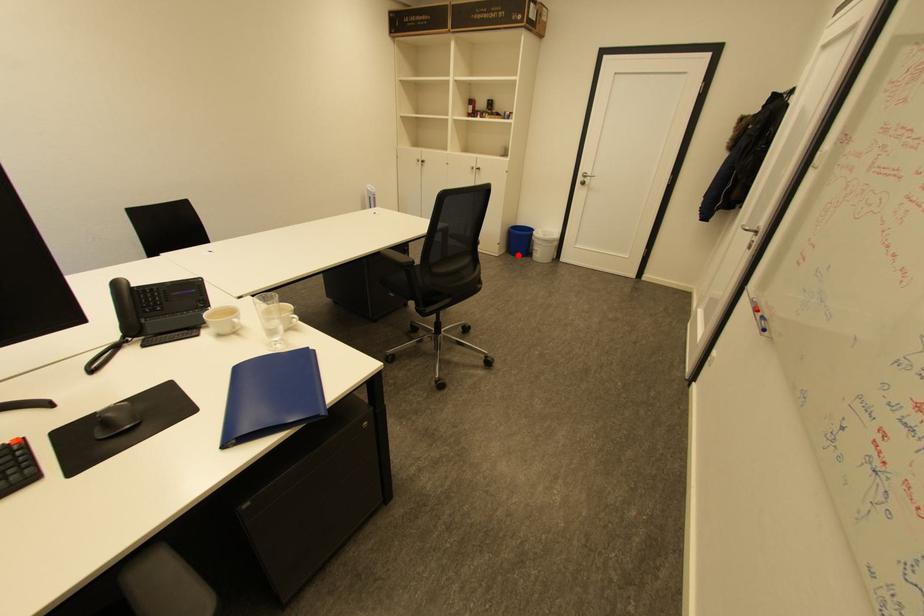
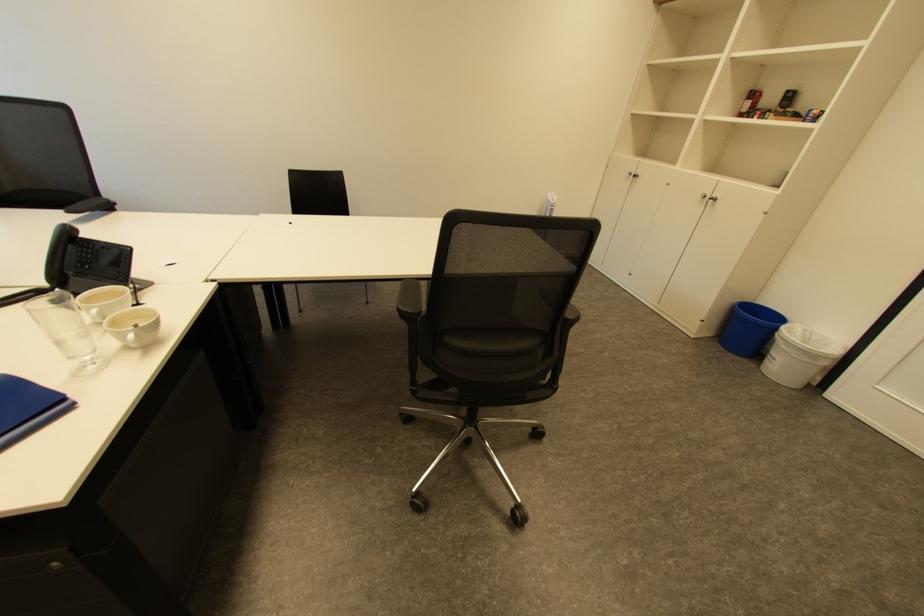
Question: A red point is marked in image1. In image2, is the corresponding 3D point closer to the camera or farther? Reply with the corresponding letter.

Choices:
 (A) The corresponding 3D point is closer.
 (B) The corresponding 3D point is farther.

Answer: (A)